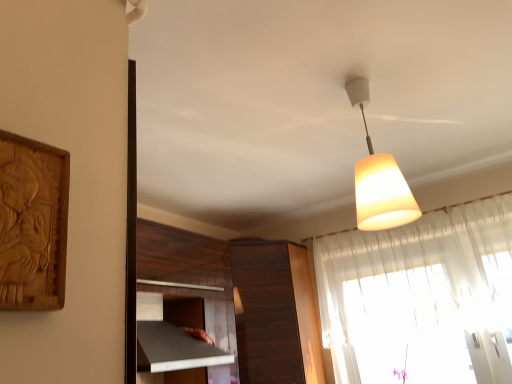
Question: Does dark wood cabinet at center have a greater height compared to white matte lampshade at upper center?

Choices:
 (A) yes
 (B) no

Answer: (A)

Question: Can white matte lampshade at upper center be found inside dark wood cabinet at center?

Choices:
 (A) yes
 (B) no

Answer: (B)

Question: Is dark wood cabinet at center facing away from white matte lampshade at upper center?

Choices:
 (A) no
 (B) yes

Answer: (A)

Question: Is dark wood cabinet at center directly adjacent to white matte lampshade at upper center?

Choices:
 (A) no
 (B) yes

Answer: (A)

Question: Does dark wood cabinet at center appear on the left side of white matte lampshade at upper center?

Choices:
 (A) no
 (B) yes

Answer: (B)

Question: From the image's perspective, is dark wood cabinet at center above white matte lampshade at upper center?

Choices:
 (A) no
 (B) yes

Answer: (A)

Question: Is white matte lampshade at upper center facing towards translucent fabric curtain at upper right?

Choices:
 (A) yes
 (B) no

Answer: (B)

Question: Is white matte lampshade at upper center in front of translucent fabric curtain at upper right?

Choices:
 (A) no
 (B) yes

Answer: (B)

Question: Considering the relative sizes of white matte lampshade at upper center and translucent fabric curtain at upper right in the image provided, is white matte lampshade at upper center wider than translucent fabric curtain at upper right?

Choices:
 (A) yes
 (B) no

Answer: (A)

Question: From a real-world perspective, is white matte lampshade at upper center on top of translucent fabric curtain at upper right?

Choices:
 (A) no
 (B) yes

Answer: (B)

Question: Considering the relative positions of white matte lampshade at upper center and translucent fabric curtain at upper right in the image provided, is white matte lampshade at upper center to the left of translucent fabric curtain at upper right from the viewer's perspective?

Choices:
 (A) no
 (B) yes

Answer: (B)

Question: Is white matte lampshade at upper center with translucent fabric curtain at upper right?

Choices:
 (A) yes
 (B) no

Answer: (B)

Question: From the image's perspective, is dark wood cabinet at center over translucent fabric curtain at upper right?

Choices:
 (A) yes
 (B) no

Answer: (B)